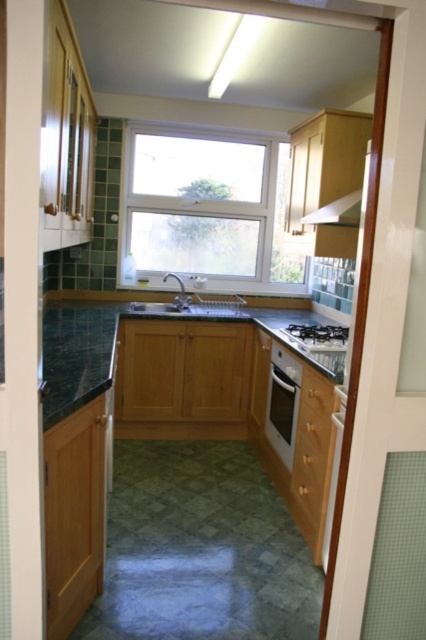
You are standing in the kitchen doorway and notice two points marked on the wall. The first point is at coordinates point (359,193) and the second is at point (311,344). If you want to place a small shelf between them, which point should the shelf be closer to in order to be positioned behind the second point?

The shelf should be placed closer to point (359,193) because it is behind point (311,344), so positioning it near the first point would place it behind the second point.

In the scene shown: You are a kitchen designer planning to install a new appliance. You have a limited budget and can only choose one between the white glossy exhaust hood at upper right and the black matte gas stove at center. Based on their sizes, which one would you prioritize for a larger space?

The white glossy exhaust hood at upper right is already larger in size than the black matte gas stove at center, so it would be better to prioritize the black matte gas stove at center for a larger space to ensure it can accommodate the stove properly.